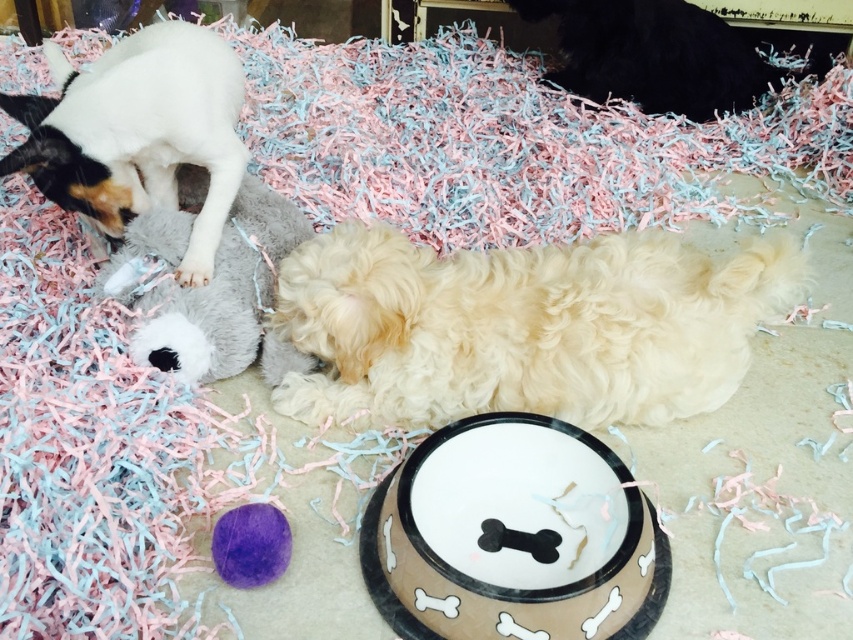
Question: From the image, what is the correct spatial relationship of white fluffy dog at center in relation to brown ceramic bowl at center?

Choices:
 (A) left
 (B) right

Answer: (B)

Question: Which is farther from the brown ceramic bowl at center?

Choices:
 (A) purple fuzzy ball at center
 (B) white fluffy dog at center

Answer: (A)

Question: Which of the following is the closest to the observer?

Choices:
 (A) purple fuzzy ball at center
 (B) white fluffy dog at center

Answer: (A)

Question: Does white fluffy dog at center appear under purple fuzzy ball at center?

Choices:
 (A) yes
 (B) no

Answer: (B)

Question: Considering the real-world distances, which object is farthest from the purple fuzzy ball at center?

Choices:
 (A) white soft plush toy at upper left
 (B) brown ceramic bowl at center

Answer: (A)

Question: Is brown ceramic bowl at center closer to the viewer compared to white soft plush toy at upper left?

Choices:
 (A) yes
 (B) no

Answer: (A)